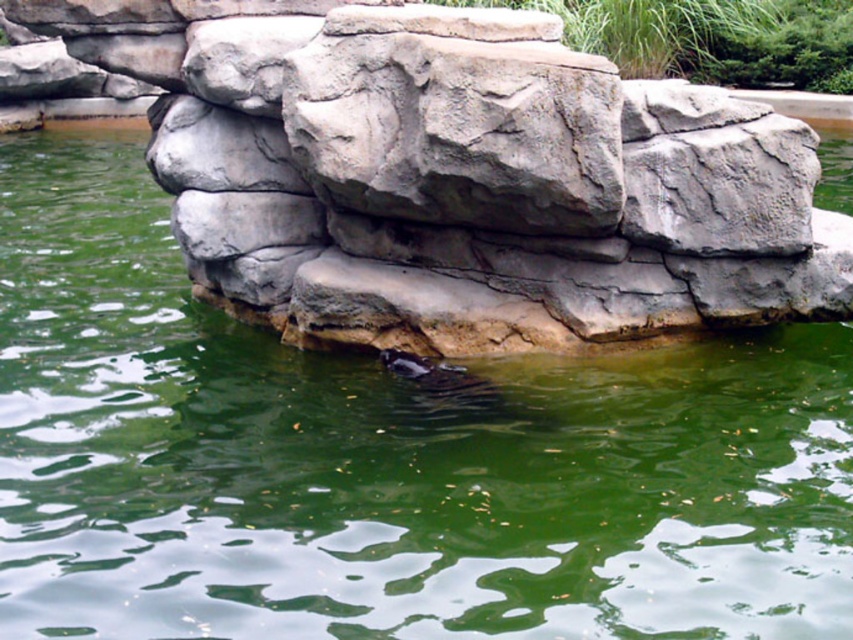
Question: Is gray stone rock at center positioned behind gray rough rock at center?

Choices:
 (A) yes
 (B) no

Answer: (A)

Question: Considering the real-world distances, which object is farthest from the gray stone rock at center?

Choices:
 (A) gray rough rock at center
 (B) shiny brown otter at center

Answer: (B)

Question: Estimate the real-world distances between objects in this image. Which object is closer to the gray stone rock at center?

Choices:
 (A) gray rough rock at center
 (B) shiny brown otter at center

Answer: (A)

Question: Does gray rough rock at center appear on the left side of shiny brown otter at center?

Choices:
 (A) no
 (B) yes

Answer: (A)

Question: Does gray stone rock at center come in front of gray rough rock at center?

Choices:
 (A) no
 (B) yes

Answer: (A)

Question: Which object appears closest to the camera in this image?

Choices:
 (A) shiny brown otter at center
 (B) gray rough rock at center

Answer: (B)